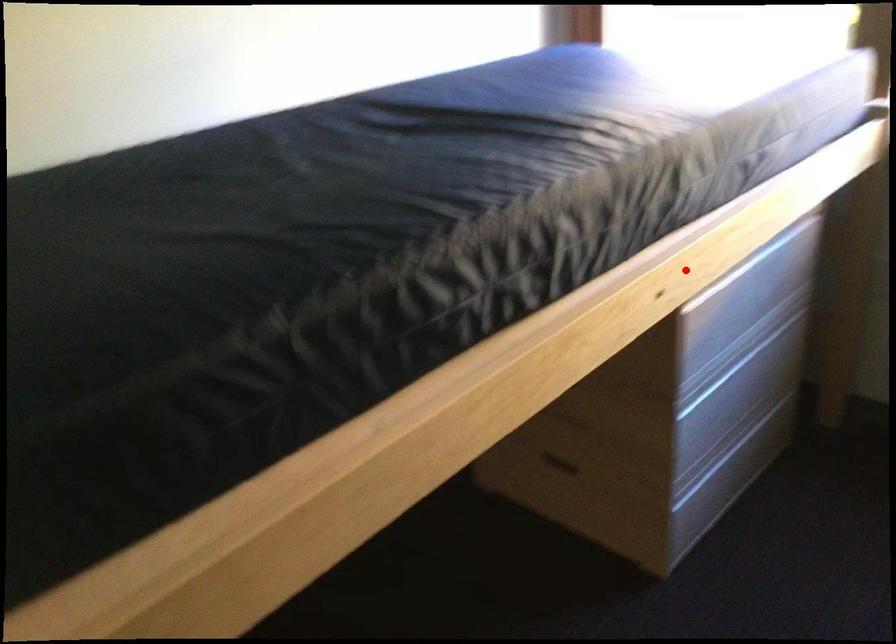
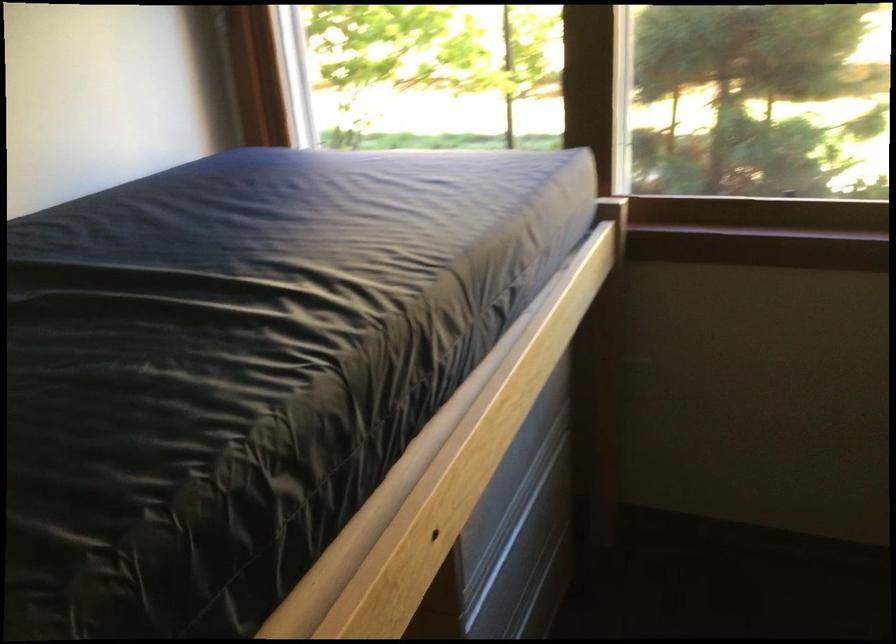
Question: I am providing you with two images of the same scene from different viewpoints. In image1, a red point is highlighted. Considering the same 3D point in image2, which of the following is correct?

Choices:
 (A) It is closer
 (B) It is farther

Answer: (A)